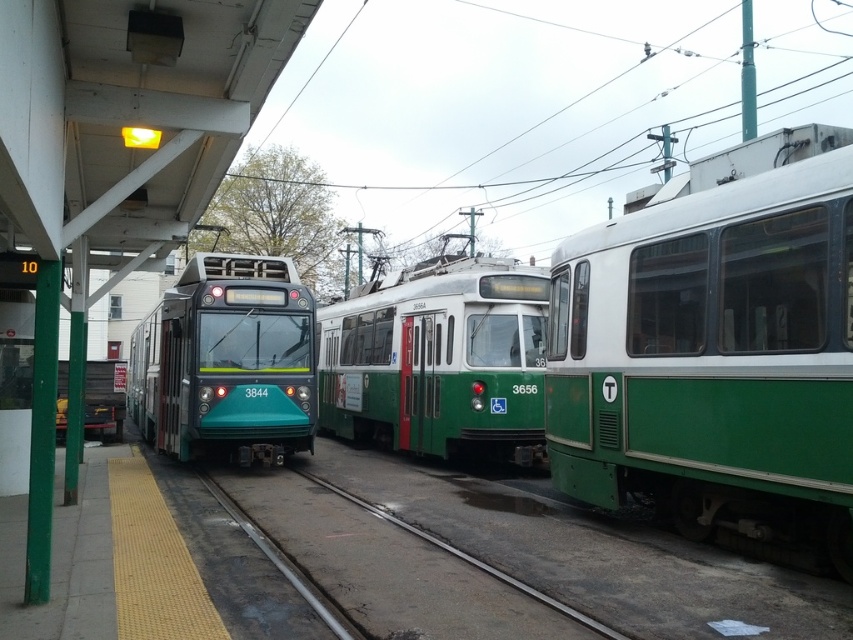
Question: Does green matte train at right have a smaller size compared to metal at center?

Choices:
 (A) yes
 (B) no

Answer: (B)

Question: Can you confirm if green matte train at center is bigger than teal glossy train at center?

Choices:
 (A) yes
 (B) no

Answer: (B)

Question: Among these objects, which one is farthest from the camera?

Choices:
 (A) metal at center
 (B) teal glossy train at center
 (C) green matte train at right

Answer: (B)

Question: Does green matte train at center appear over metal at center?

Choices:
 (A) yes
 (B) no

Answer: (A)

Question: Which point appears farthest from the camera in this image?

Choices:
 (A) (524, 588)
 (B) (670, 412)
 (C) (438, 260)

Answer: (C)

Question: Among these objects, which one is farthest from the camera?

Choices:
 (A) green matte train at center
 (B) metal at center

Answer: (A)